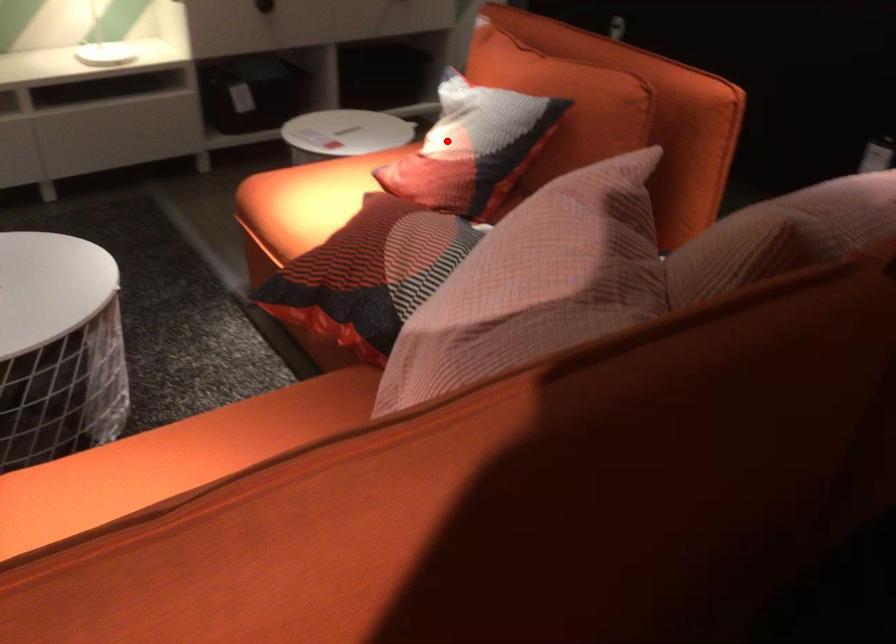
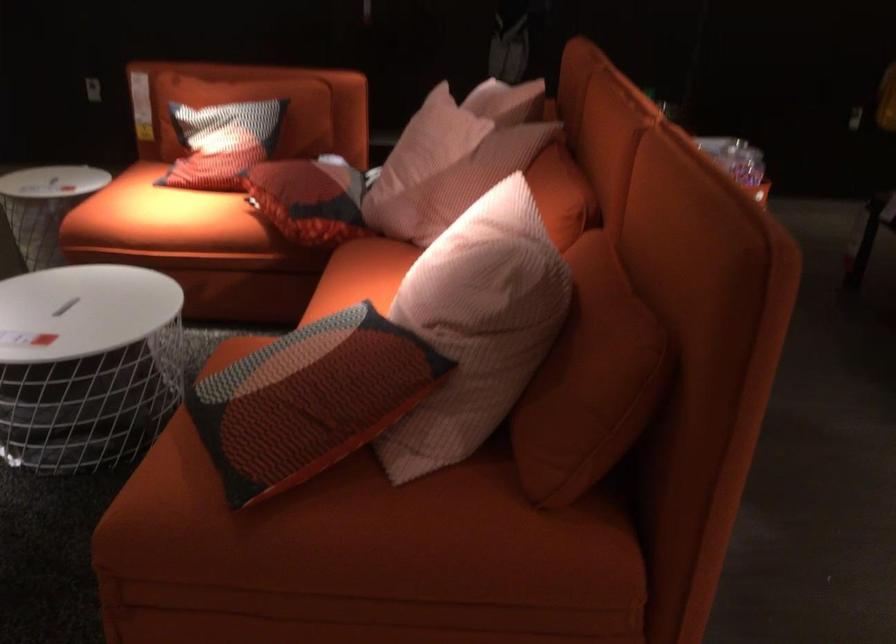
Question: I am providing you with two images of the same scene from different viewpoints. In image1, a red point is highlighted. Considering the same 3D point in image2, which of the following is correct?

Choices:
 (A) It is closer
 (B) It is farther

Answer: (B)